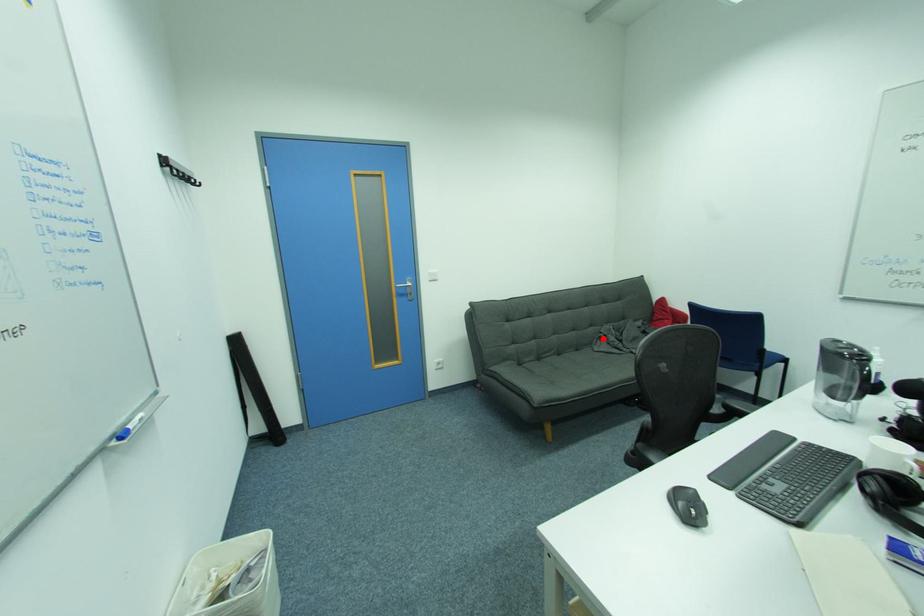
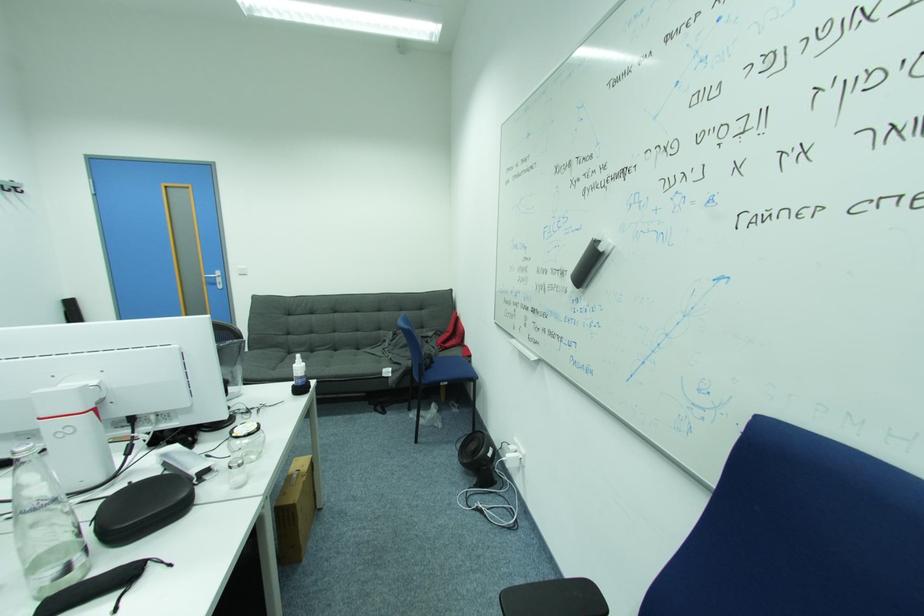
Locate, in the second image, the point that corresponds to the highlighted location in the first image.

(388, 341)